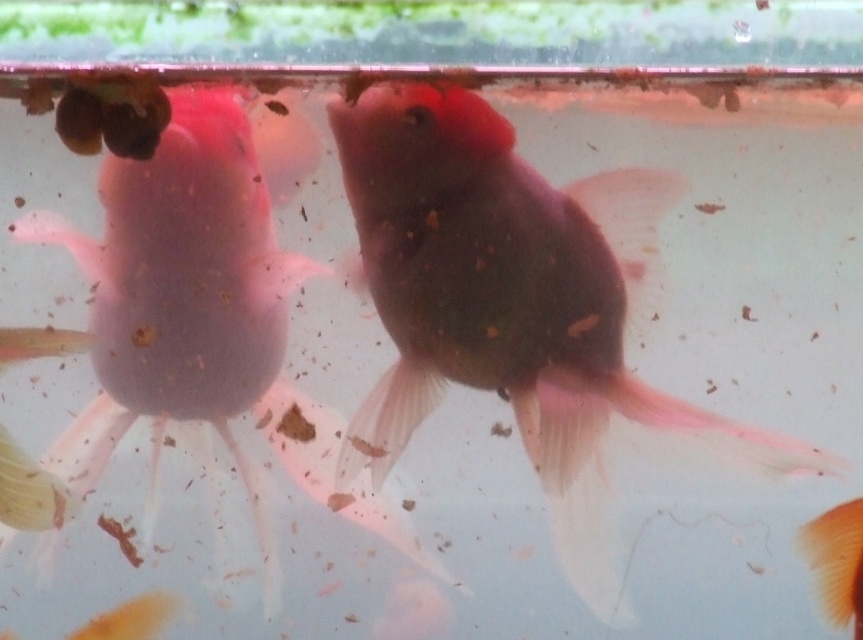
You are a pet store employee who needs to place the two fish into a new tank. The tank has a divider that allows a minimum distance of 6 inches between them. Can the matte pink goldfish at center and the pink translucent fish at left be placed on opposite sides of the divider without violating the minimum distance requirement?

The matte pink goldfish at center is 6.12 inches from the pink translucent fish at left. Since 6.12 inches is greater than the minimum required distance of 6 inches, they can be placed on opposite sides of the divider without violating the requirement.

You are standing in front of a fish tank and see the matte pink goldfish at center. If you want to reach the fish with a net that has a 3.5 feet handle, will you be able to do so?

The distance between you and the matte pink goldfish at center is 4.04 feet, which is longer than the net handle of 3.5 feet. Therefore, you cannot reach the matte pink goldfish at center with the net.

You are an aquarium keeper looking at the fish tank. You see the matte pink goldfish at center and the pink translucent fish at left. Which one is positioned more to the right side of the tank?

The matte pink goldfish at center is positioned more to the right side of the tank than the pink translucent fish at left.